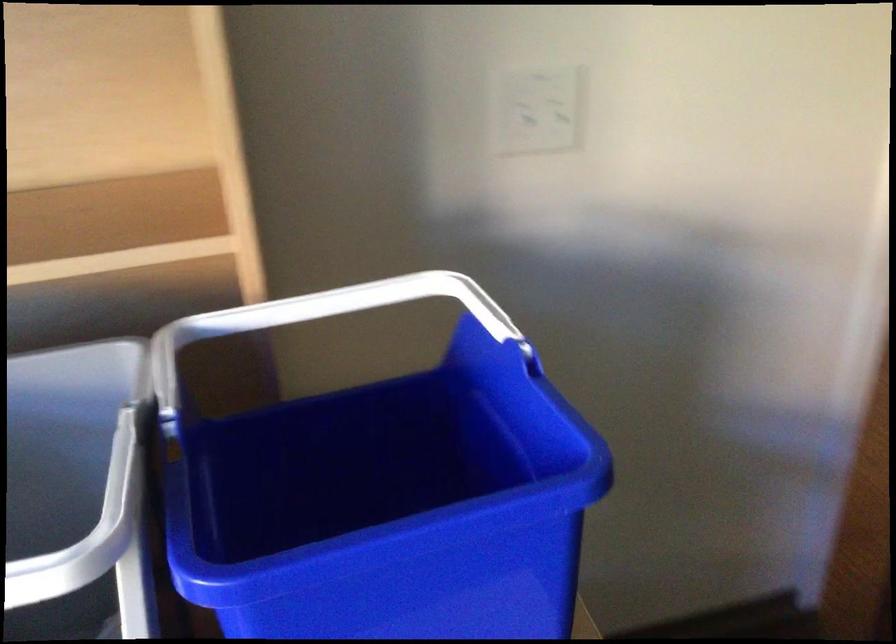
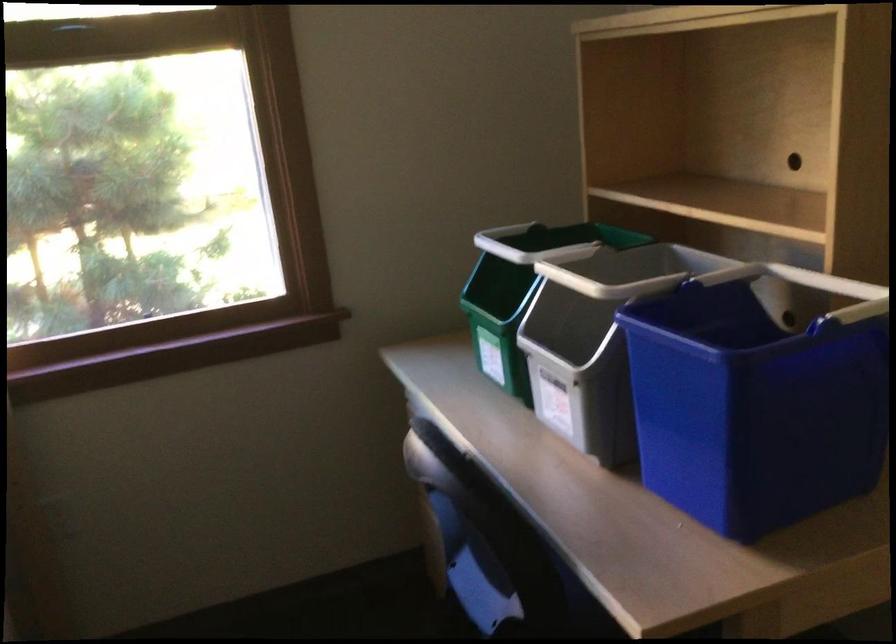
First-person continuous shooting, in which direction is the camera rotating?

The camera's rotation is toward left-down.